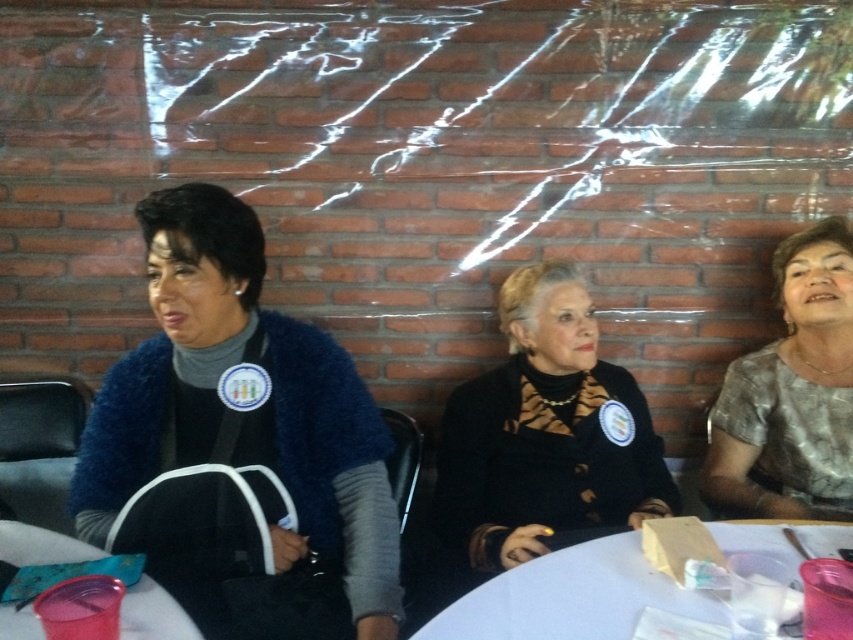
You are organizing a charity clothing drive and need to determine which items can fit into a donation box that has a width capacity of 30 cm. You have two items to assess from the image provided. Which of the two items, the blue fuzzy sweater at left or the black textured jacket at center, is more likely to exceed the width limit based on their sizes in the image?

The blue fuzzy sweater at left has a larger width than the black textured jacket at center, so it is more likely to exceed the 30 cm width limit and not fit into the donation box.

Consider the image. You are a photographer at a formal event and need to capture a photo of the blue fuzzy sweater at left and the black textured jacket at center. Based on their positions, which one is located more to the left?

The blue fuzzy sweater at left is positioned on the left side of the black textured jacket at center, so the blue fuzzy sweater at left is more to the left.